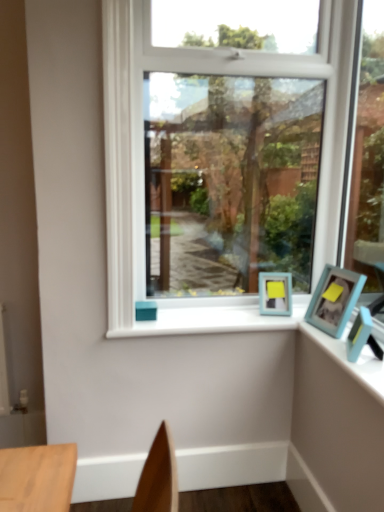
Question: Is teal matte picture frame at right, which is the second picture frame in back-to-front order, bigger than white painted wood at center?

Choices:
 (A) no
 (B) yes

Answer: (A)

Question: Considering the relative sizes of teal matte picture frame at right, which is the second picture frame in back-to-front order, and white painted wood at center in the image provided, is teal matte picture frame at right, which is the second picture frame in back-to-front order, thinner than white painted wood at center?

Choices:
 (A) no
 (B) yes

Answer: (B)

Question: Can white painted wood at center be found inside teal matte picture frame at right, which is the second picture frame in back-to-front order?

Choices:
 (A) no
 (B) yes

Answer: (A)

Question: Is teal matte picture frame at right, which is the second picture frame in back-to-front order, aimed at white painted wood at center?

Choices:
 (A) no
 (B) yes

Answer: (B)

Question: Does teal matte picture frame at right, the first picture frame viewed from the front, appear on the left side of white painted wood at center?

Choices:
 (A) yes
 (B) no

Answer: (B)

Question: Is the position of teal matte picture frame at right, the first picture frame viewed from the front, more distant than that of white painted wood at center?

Choices:
 (A) no
 (B) yes

Answer: (A)

Question: Does teal matte picture frame at right, which is the second picture frame in back-to-front order, appear on the left side of clear glass window at center?

Choices:
 (A) yes
 (B) no

Answer: (B)

Question: Is teal matte picture frame at right, which is the second picture frame in back-to-front order, taller than clear glass window at center?

Choices:
 (A) yes
 (B) no

Answer: (B)

Question: Is the surface of teal matte picture frame at right, the first picture frame viewed from the front, in direct contact with clear glass window at center?

Choices:
 (A) yes
 (B) no

Answer: (B)

Question: Is teal matte picture frame at right, the first picture frame viewed from the front, far from clear glass window at center?

Choices:
 (A) no
 (B) yes

Answer: (A)

Question: Is teal matte picture frame at right, which is the second picture frame in back-to-front order, turned away from clear glass window at center?

Choices:
 (A) yes
 (B) no

Answer: (B)

Question: Does teal matte picture frame at right, the first picture frame viewed from the front, have a greater width compared to clear glass window at center?

Choices:
 (A) no
 (B) yes

Answer: (B)

Question: Could you tell me if white painted wood at center is turned towards blue plastic photo frame at upper right?

Choices:
 (A) no
 (B) yes

Answer: (A)